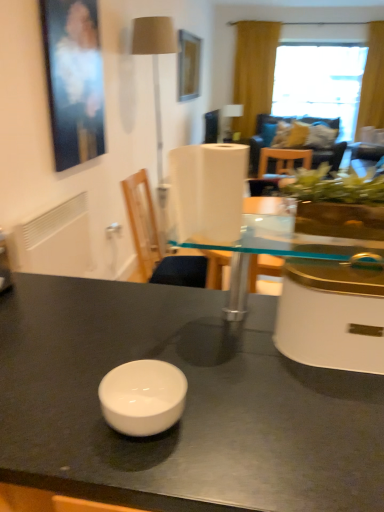
Image resolution: width=384 pixels, height=512 pixels. What do you see at coordinates (157, 240) in the screenshot?
I see `white plastic chair at center` at bounding box center [157, 240].

Identify the location of velvet blue couch at upper right. The height and width of the screenshot is (512, 384). (264, 137).

Identify the location of transparent glass table at center. The image size is (384, 512). (276, 247).

Consider the image. In order to face matte black picture frame at upper left, the 2th picture frame in the back-to-front sequence, should I rotate leftwards or rightwards?

Turn left by 14.454 degrees to look at matte black picture frame at upper left, the 2th picture frame in the back-to-front sequence.

This screenshot has height=512, width=384. Identify the location of white glossy bowl at center. (143, 397).

Looking at this image, would you say yellow fabric curtain at upper right is outside wooden picture frame at upper center, the 2th picture frame in the bottom-to-top sequence?

Indeed, yellow fabric curtain at upper right is completely outside wooden picture frame at upper center, the 2th picture frame in the bottom-to-top sequence.

Is yellow fabric curtain at upper right directly adjacent to wooden picture frame at upper center, the 2th picture frame in the bottom-to-top sequence?

yellow fabric curtain at upper right is not next to wooden picture frame at upper center, the 2th picture frame in the bottom-to-top sequence, and they're not touching.

Does yellow fabric curtain at upper right turn towards wooden picture frame at upper center, the 2th picture frame positioned from the front?

Yes, yellow fabric curtain at upper right is aimed at wooden picture frame at upper center, the 2th picture frame positioned from the front.

Considering the relative positions of yellow fabric curtain at upper right and wooden picture frame at upper center, the 1th picture frame when ordered from right to left, in the image provided, is yellow fabric curtain at upper right behind wooden picture frame at upper center, the 1th picture frame when ordered from right to left,?

Yes.

Based on the photo, is the depth of velvet blue couch at upper right greater than that of yellow fabric curtain at upper right?

No, velvet blue couch at upper right is closer to the camera.

From a real-world perspective, relative to yellow fabric curtain at upper right, is velvet blue couch at upper right vertically above or below?

velvet blue couch at upper right is below yellow fabric curtain at upper right.

From the image's perspective, is velvet blue couch at upper right located beneath yellow fabric curtain at upper right?

Yes, from the image's perspective, velvet blue couch at upper right is below yellow fabric curtain at upper right.

The height and width of the screenshot is (512, 384). What are the coordinates of `couch below the yellow fabric curtain at upper right (from the image's perspective)` in the screenshot? It's located at (264, 137).

Would you say white glossy bowl at center is outside wooden picture frame at upper center, the 1th picture frame when ordered from right to left?

Yes.

Is white glossy bowl at center positioned before wooden picture frame at upper center, the first picture frame in the top-to-bottom sequence?

That is True.

From the picture: Does white glossy bowl at center have a lesser width compared to wooden picture frame at upper center, the first picture frame in the top-to-bottom sequence?

No, white glossy bowl at center is not thinner than wooden picture frame at upper center, the first picture frame in the top-to-bottom sequence.

Between white glossy bowl at center and wooden picture frame at upper center, the 2th picture frame in the bottom-to-top sequence, which one has smaller size?

With smaller size is wooden picture frame at upper center, the 2th picture frame in the bottom-to-top sequence.

Consider the image. From a real-world perspective, is white matte radiator at left on velvet blue couch at upper right?

Indeed, from a real-world perspective, white matte radiator at left stands above velvet blue couch at upper right.

Can you tell me how much white matte radiator at left and velvet blue couch at upper right differ in facing direction?

The angle between the facing direction of white matte radiator at left and the facing direction of velvet blue couch at upper right is 91.7 degrees.

Is white matte radiator at left turned away from velvet blue couch at upper right?

No, velvet blue couch at upper right is not at the back of white matte radiator at left.

The image size is (384, 512). What are the coordinates of `couch that appears behind the white matte radiator at left` in the screenshot? It's located at (264, 137).

Can you confirm if matte black picture frame at upper left, arranged as the 2th picture frame when viewed from the top, is taller than white plastic chair at center?

Indeed, matte black picture frame at upper left, arranged as the 2th picture frame when viewed from the top, has a greater height compared to white plastic chair at center.

Is matte black picture frame at upper left, marked as the 1th picture frame in a left-to-right arrangement, outside of white plastic chair at center?

Yes.

The height and width of the screenshot is (512, 384). Identify the location of chair below the matte black picture frame at upper left, which appears as the 1th picture frame when viewed from the front (from the image's perspective). [x=157, y=240].

Is matte black picture frame at upper left, marked as the 1th picture frame in a left-to-right arrangement, bigger than white plastic chair at center?

Incorrect, matte black picture frame at upper left, marked as the 1th picture frame in a left-to-right arrangement, is not larger than white plastic chair at center.

Between white glossy bowl at center and transparent glass table at center, which one appears on the right side from the viewer's perspective?

Positioned to the right is transparent glass table at center.

Is point (120, 383) closer or farther from the camera than point (335, 240)?

Point (120, 383) appears to be closer to the viewer than point (335, 240).

Could you tell me if white glossy bowl at center is facing transparent glass table at center?

No, white glossy bowl at center is not facing towards transparent glass table at center.

From a real-world perspective, which is physically below, beige fabric lampshade at upper left or matte black picture frame at upper left, the 2th picture frame in the back-to-front sequence?

beige fabric lampshade at upper left is physically lower.

Consider the image. Is beige fabric lampshade at upper left oriented towards matte black picture frame at upper left, marked as the 1th picture frame in a left-to-right arrangement?

No, beige fabric lampshade at upper left is not aimed at matte black picture frame at upper left, marked as the 1th picture frame in a left-to-right arrangement.

Is beige fabric lampshade at upper left touching matte black picture frame at upper left, placed as the second picture frame when sorted from right to left?

No, beige fabric lampshade at upper left is not next to matte black picture frame at upper left, placed as the second picture frame when sorted from right to left.

Identify the location of the 1st picture frame positioned below the yellow fabric curtain at upper right (from the image's perspective). (188, 66).

Identify the location of curtain above the velvet blue couch at upper right (from the image's perspective). This screenshot has width=384, height=512. (254, 72).

Looking at the image, which one is located further to velvet blue couch at upper right, beige fabric lampshade at upper left or yellow fabric curtain at upper right?

The object further to velvet blue couch at upper right is beige fabric lampshade at upper left.

Estimate the real-world distances between objects in this image. Which object is further from transparent glass table at center, transparent glass window at upper right or white glossy bowl at center?

Among the two, transparent glass window at upper right is located further to transparent glass table at center.

From the image, which object appears to be nearer to yellow fabric curtain at upper right, wooden picture frame at upper center, the second picture frame in the left-to-right sequence, or white plastic chair at center?

wooden picture frame at upper center, the second picture frame in the left-to-right sequence.

Estimate the real-world distances between objects in this image. Which object is further from beige fabric lampshade at upper left, velvet blue couch at upper right or wooden picture frame at upper center, the first picture frame in the top-to-bottom sequence?

The object further to beige fabric lampshade at upper left is velvet blue couch at upper right.

Looking at this image, from the image, which object appears to be farther from velvet blue couch at upper right, wooden picture frame at upper center, the 1th picture frame when ordered from right to left, or transparent glass window at upper right?

wooden picture frame at upper center, the 1th picture frame when ordered from right to left, is positioned further to the anchor velvet blue couch at upper right.

When comparing their distances from white glossy bowl at center, does white plastic chair at center or wooden picture frame at upper center, the 2th picture frame in the bottom-to-top sequence, seem closer?

The object closer to white glossy bowl at center is white plastic chair at center.

From the image, which object appears to be nearer to yellow fabric curtain at upper right, transparent glass table at center or wooden picture frame at upper center, positioned as the first picture frame in back-to-front order?

Result: wooden picture frame at upper center, positioned as the first picture frame in back-to-front order.

Based on their spatial positions, is white matte radiator at left or white plastic chair at center closer to wooden picture frame at upper center, the second picture frame in the left-to-right sequence?

The object closer to wooden picture frame at upper center, the second picture frame in the left-to-right sequence, is white plastic chair at center.

At what (x,y) coordinates should I click in order to perform the action: click on radiator between white glossy bowl at center and transparent glass window at upper right in the front-back direction. Please return your answer as a coordinate pair (x, y). The image size is (384, 512). Looking at the image, I should click on (55, 240).

You are a GUI agent. You are given a task and a screenshot of the screen. Output one action in this format:
    pyautogui.click(x=<x>, y=<y>)
    Task: Click on the round table positioned between white glossy bowl at center and transparent glass window at upper right from near to far
    The image size is (384, 512).
    Given the screenshot: What is the action you would take?
    pyautogui.click(x=276, y=247)

This screenshot has width=384, height=512. Find the location of `table lamp between white plastic chair at center and velvet blue couch at upper right in the front-back direction`. table lamp between white plastic chair at center and velvet blue couch at upper right in the front-back direction is located at coordinates (155, 70).

This screenshot has height=512, width=384. What are the coordinates of `couch between white glossy bowl at center and yellow fabric curtain at upper right from front to back` in the screenshot? It's located at (264, 137).